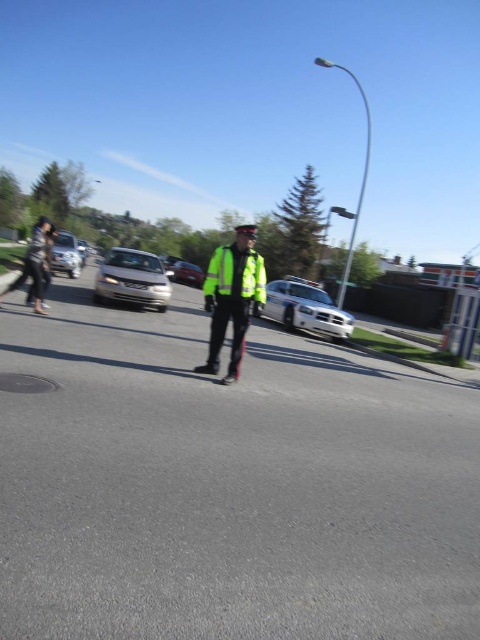
You are a pedestrian standing at the point with coordinates point (235, 292) and want to walk to the point with coordinates point (207, 292). Given that the police officer is between these two points, can you safely walk directly to your destination without crossing the officer?

Point (235, 292) is in front of point (207, 292), meaning the officer is blocking the path between them. Therefore, you cannot safely walk directly to your destination without crossing the officer.